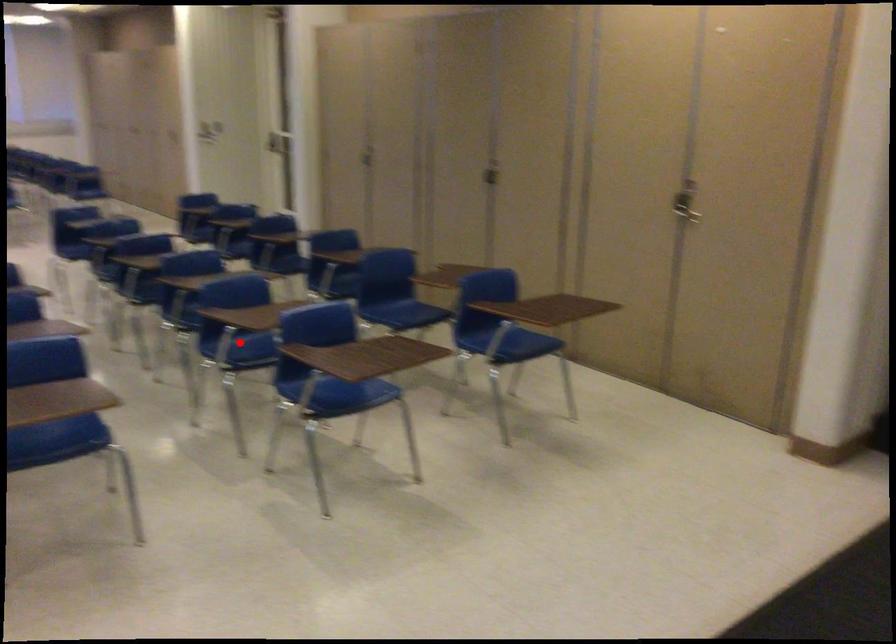
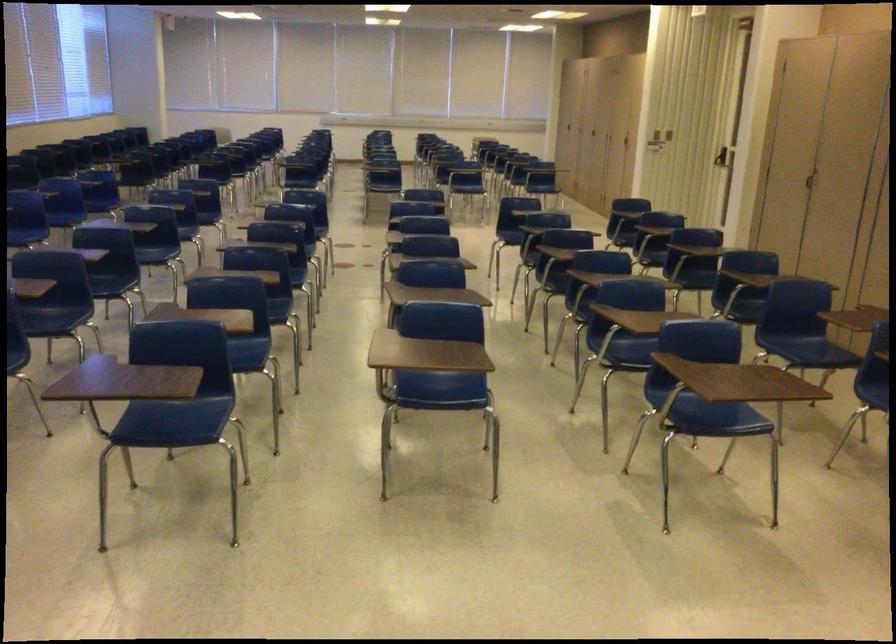
Locate, in the second image, the point that corresponds to the highlighted location in the first image.

(625, 345)